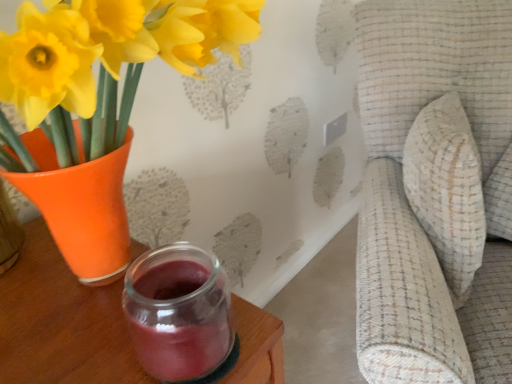
Question: In the image, is transparent glass jar at lower center on the left side or the right side of matte orange vase at left?

Choices:
 (A) right
 (B) left

Answer: (A)

Question: From their relative heights in the image, would you say transparent glass jar at lower center is taller or shorter than matte orange vase at left?

Choices:
 (A) tall
 (B) short

Answer: (B)

Question: Estimate the real-world distances between objects in this image. Which object is closer to the matte orange vase at left?

Choices:
 (A) transparent glass jar at lower center
 (B) textured beige cushion at right

Answer: (A)

Question: Estimate the real-world distances between objects in this image. Which object is farther from the transparent glass jar at lower center?

Choices:
 (A) textured beige cushion at right
 (B) matte orange vase at left

Answer: (A)